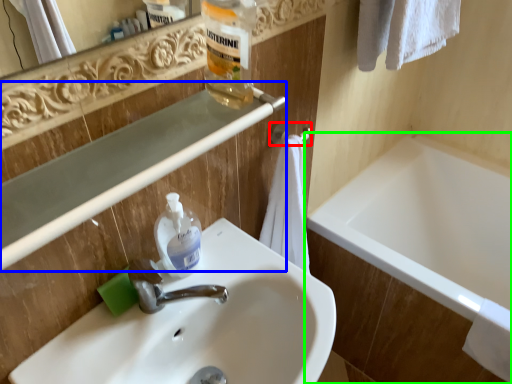
Question: Based on their relative distances, which object is nearer to towel bar (highlighted by a red box)? Choose from balustrade (highlighted by a blue box) and bathtub (highlighted by a green box).

Choices:
 (A) balustrade
 (B) bathtub

Answer: (A)